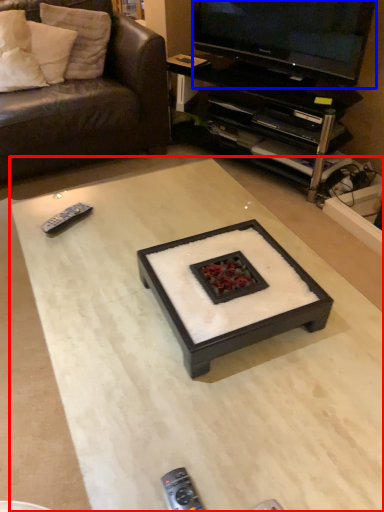
Question: Which object is closer to the camera taking this photo, coffee table (highlighted by a red box) or television (highlighted by a blue box)?

Choices:
 (A) coffee table
 (B) television

Answer: (A)